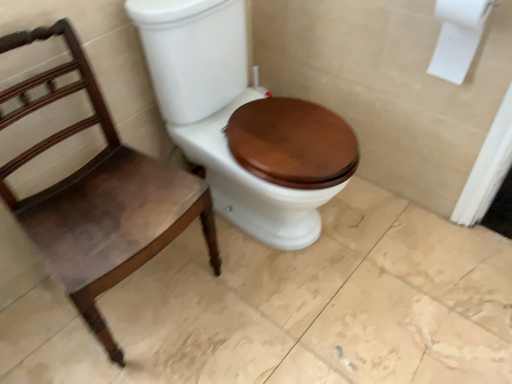
Question: In the image, is white paper at upper right positioned in front of or behind matte brown wood toilet seat at center?

Choices:
 (A) behind
 (B) front

Answer: (A)

Question: Looking at the image, does white paper at upper right seem bigger or smaller compared to matte brown wood toilet seat at center?

Choices:
 (A) big
 (B) small

Answer: (B)

Question: Considering the real-world distances, which object is farthest from the mahogany wood chair at left?

Choices:
 (A) white paper at upper right
 (B) matte brown wood toilet seat at center

Answer: (A)

Question: Which object is positioned farthest from the mahogany wood chair at left?

Choices:
 (A) matte brown wood toilet seat at center
 (B) white paper at upper right

Answer: (B)